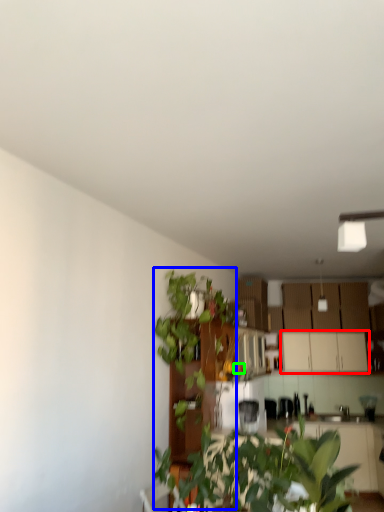
Question: Estimate the real-world distances between objects in this image. Which object is farther from cabinetry (highlighted by a red box), vegetation (highlighted by a blue box) or flower (highlighted by a green box)?

Choices:
 (A) vegetation
 (B) flower

Answer: (A)